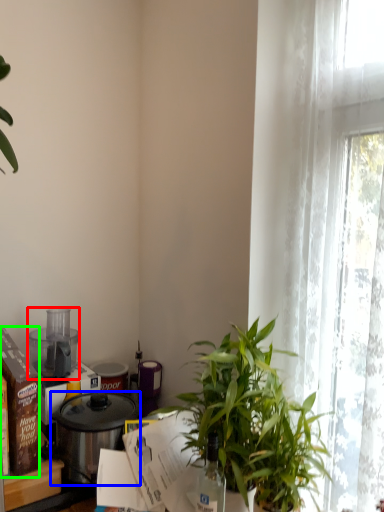
Question: Based on their relative distances, which object is nearer to kitchen appliance (highlighted by a red box)? Choose from pot/pan (highlighted by a blue box) and box (highlighted by a green box).

Choices:
 (A) pot/pan
 (B) box

Answer: (A)